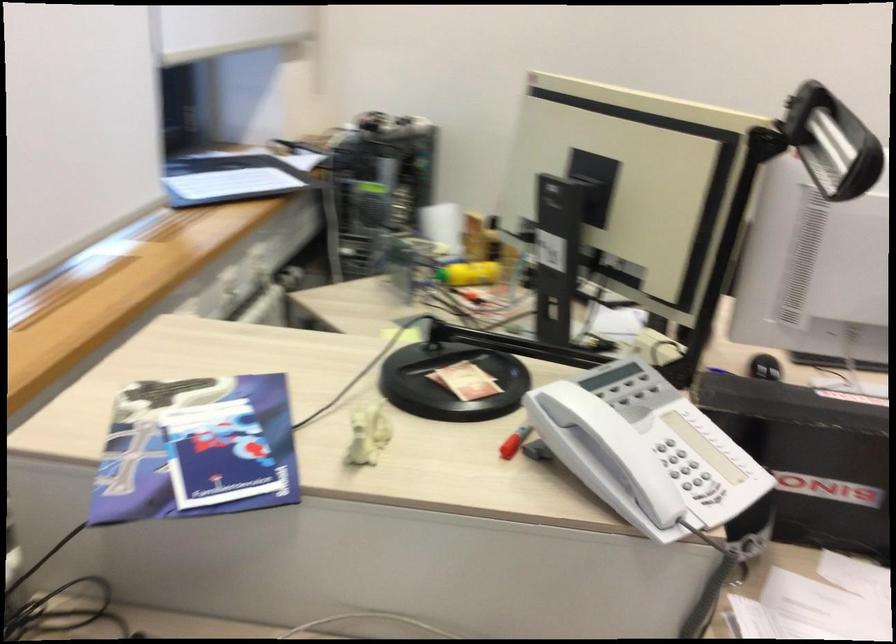
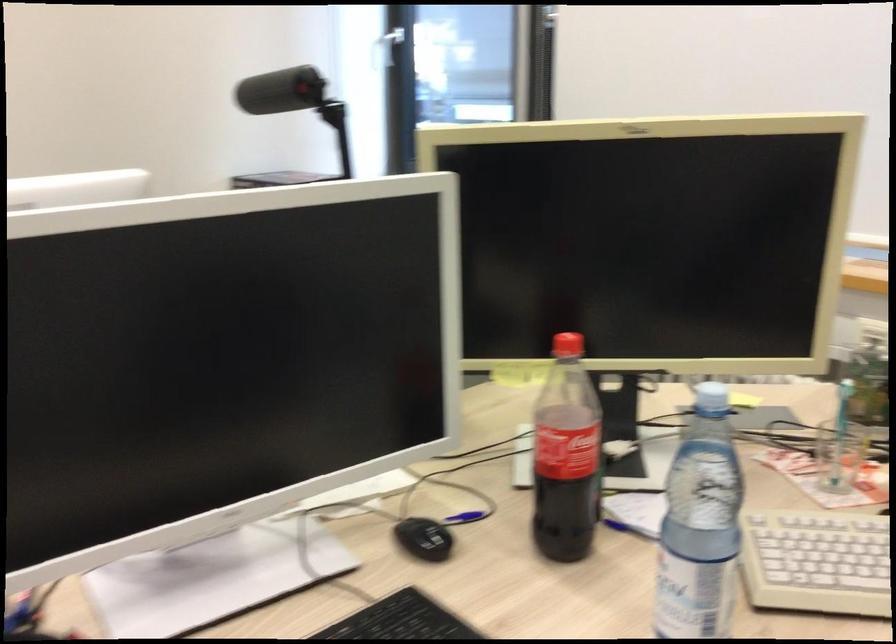
In the second image, find the point that corresponds to point 817,368 in the first image.

(401, 620)